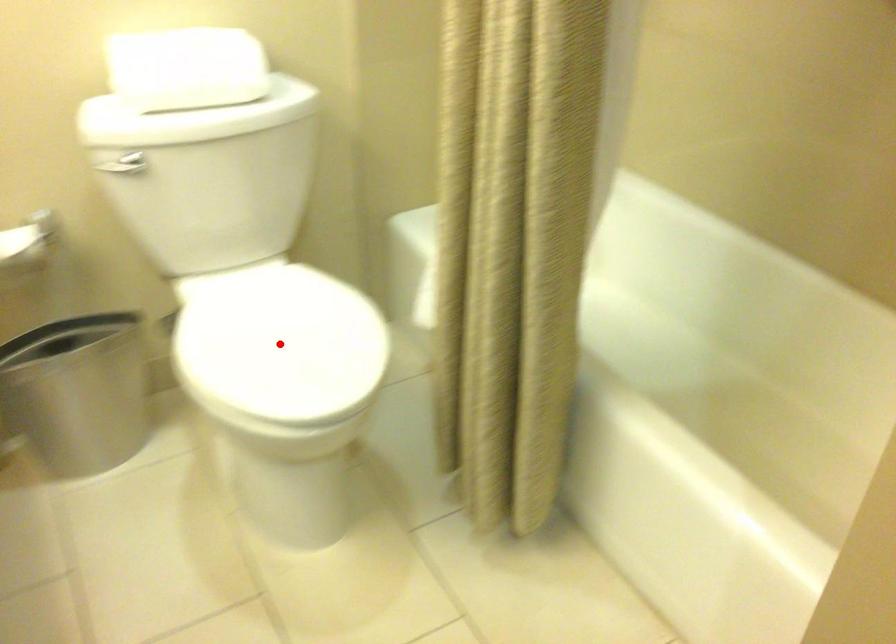
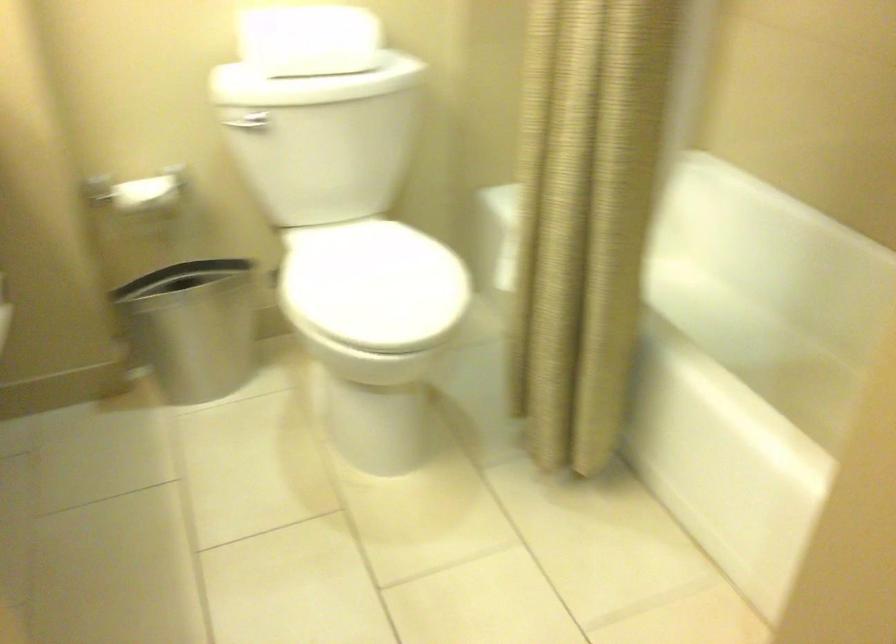
Question: I am providing you with two images of the same scene from different viewpoints. A red point is marked on the first image. Is the red point's position out of view in image 2?

Choices:
 (A) Yes
 (B) No

Answer: (B)